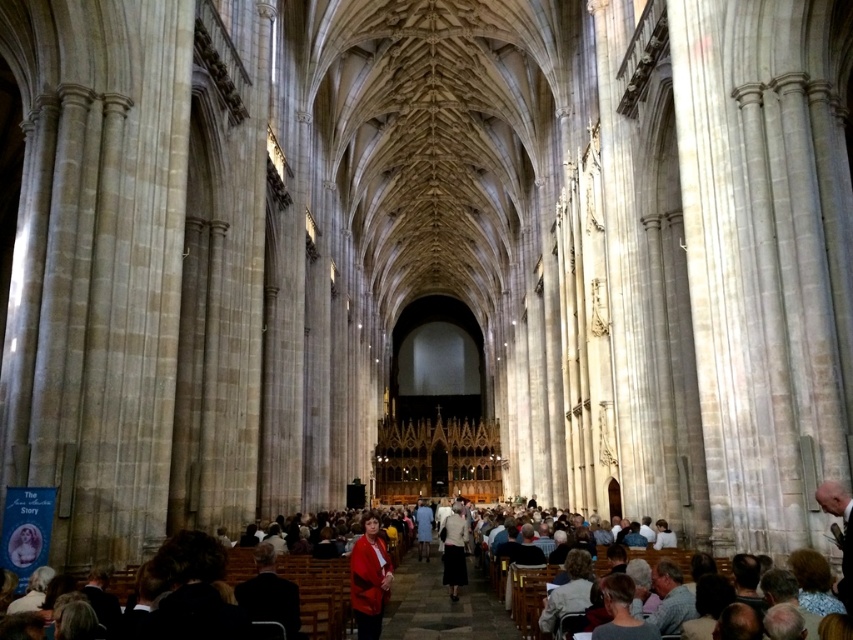
Is red fabric coat at center thinner than light beige skirt at center?

Incorrect, red fabric coat at center's width is not less than light beige skirt at center's.

Is point (442, 593) in front of point (454, 541)?

Yes, point (442, 593) is in front of point (454, 541).

Who is more forward, [521,611] or [459,547]?

Point [521,611] is in front.

This screenshot has height=640, width=853. What are the coordinates of `red fabric coat at center` in the screenshot? It's located at (466, 595).

Who is taller, red fabric coat at center or matte red coat at center?

With more height is red fabric coat at center.

Between red fabric coat at center and matte red coat at center, which one appears on the right side from the viewer's perspective?

Positioned to the right is red fabric coat at center.

Is point (404, 525) positioned behind point (379, 624)?

Yes, point (404, 525) is farther from viewer.

Locate an element on the screen. This screenshot has height=640, width=853. red fabric coat at center is located at coordinates (466, 595).

Which is above, matte red coat at center or light beige skirt at center?

matte red coat at center

Does matte red coat at center have a lesser width compared to light beige skirt at center?

No, matte red coat at center is not thinner than light beige skirt at center.

Based on the photo, who is more distant from viewer, (368, 636) or (448, 520)?

Point (448, 520)

You are a GUI agent. You are given a task and a screenshot of the screen. Output one action in this format:
    pyautogui.click(x=<x>, y=<y>)
    Task: Click on the matte red coat at center
    
    Given the screenshot: What is the action you would take?
    pyautogui.click(x=369, y=579)